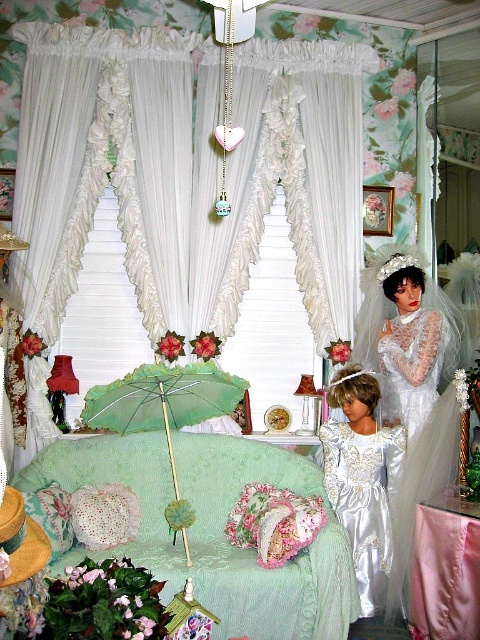
Consider the image. Can you confirm if light green fabric canopy bed at center is positioned to the right of satin/embroidered dress at center?

No, light green fabric canopy bed at center is not to the right of satin/embroidered dress at center.

Does light green fabric canopy bed at center have a lesser height compared to satin/embroidered dress at center?

Indeed, light green fabric canopy bed at center has a lesser height compared to satin/embroidered dress at center.

Locate an element on the screen. Image resolution: width=480 pixels, height=640 pixels. light green fabric canopy bed at center is located at coordinates (253, 548).

Where is `light green fabric canopy bed at center`? The image size is (480, 640). light green fabric canopy bed at center is located at coordinates (253, 548).

Does satin/embroidered dress at center have a lesser height compared to green lace parasol at center?

Incorrect, satin/embroidered dress at center's height does not fall short of green lace parasol at center's.

Describe the element at coordinates (363, 499) in the screenshot. I see `satin/embroidered dress at center` at that location.

The height and width of the screenshot is (640, 480). Identify the location of satin/embroidered dress at center. (363, 499).

At what (x,y) coordinates should I click in order to perform the action: click on satin/embroidered dress at center. Please return your answer as a coordinate pair (x, y). This screenshot has width=480, height=640. Looking at the image, I should click on (363, 499).

The image size is (480, 640). Identify the location of light green fabric canopy bed at center. pyautogui.click(x=253, y=548).

Can you confirm if light green fabric canopy bed at center is positioned to the left of satin lace dress at center?

Indeed, light green fabric canopy bed at center is positioned on the left side of satin lace dress at center.

Describe the element at coordinates (253, 548) in the screenshot. The image size is (480, 640). I see `light green fabric canopy bed at center` at that location.

Locate an element on the screen. This screenshot has width=480, height=640. light green fabric canopy bed at center is located at coordinates (253, 548).